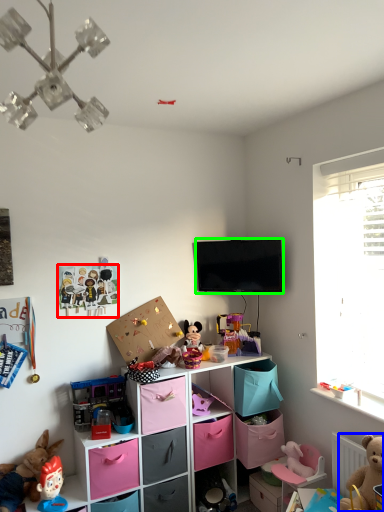
Question: Estimate the real-world distances between objects in this image. Which object is closer to toy (highlighted by a red box), toy (highlighted by a blue box) or television (highlighted by a green box)?

Choices:
 (A) toy
 (B) television

Answer: (B)